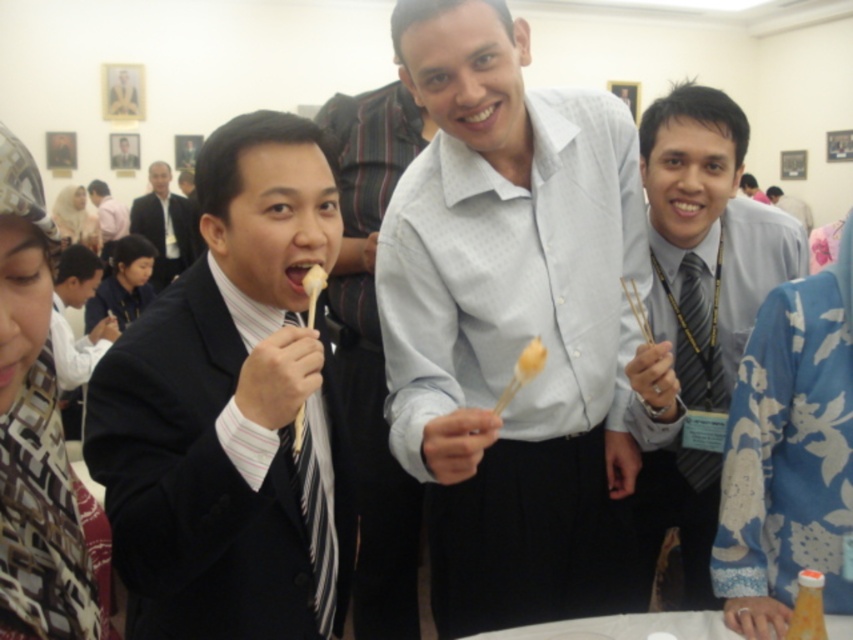
You are a photographer at the event and want to capture a closeup shot of the smooth skin face at lower left and the white matte toothpick at center. Which object will appear bigger in the photo?

The smooth skin face at lower left will appear bigger in the photo because it has a larger size compared to the white matte toothpick at center.

You are a photographer at the event and want to capture a photo of both the smooth skin face at lower left and the white matte toothpick at center. Based on their positions, which object should be placed on the left side of the photo frame?

The smooth skin face at lower left should be placed on the left side of the photo frame because it is already positioned to the left of the white matte toothpick at center.